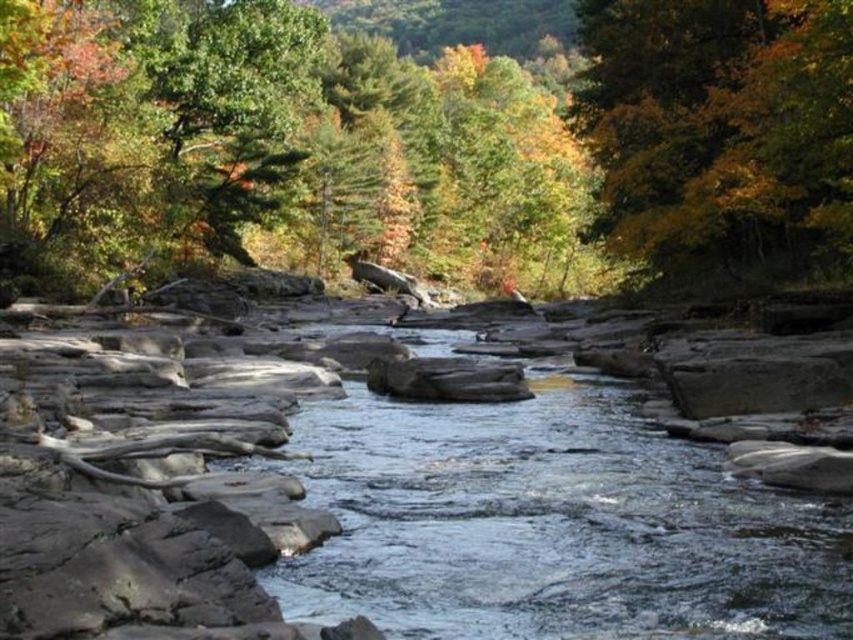
Can you confirm if green matte tree at upper center is positioned below yellow-green leaves at upper right?

Incorrect, green matte tree at upper center is not positioned below yellow-green leaves at upper right.

Which is behind, point (813, 170) or point (814, 70)?

The point (813, 170) is more distant.

Locate an element on the screen. This screenshot has height=640, width=853. green matte tree at upper center is located at coordinates (422, 145).

Is clear water at center bigger than yellow-green leaves at upper right?

No.

From the picture: Is clear water at center closer to camera compared to yellow-green leaves at upper right?

Yes, clear water at center is closer to the viewer.

The height and width of the screenshot is (640, 853). Identify the location of clear water at center. (552, 525).

Can you confirm if green matte tree at upper center is smaller than clear water at center?

No.

The width and height of the screenshot is (853, 640). What do you see at coordinates (422, 145) in the screenshot? I see `green matte tree at upper center` at bounding box center [422, 145].

This screenshot has height=640, width=853. What are the coordinates of `green matte tree at upper center` in the screenshot? It's located at (422, 145).